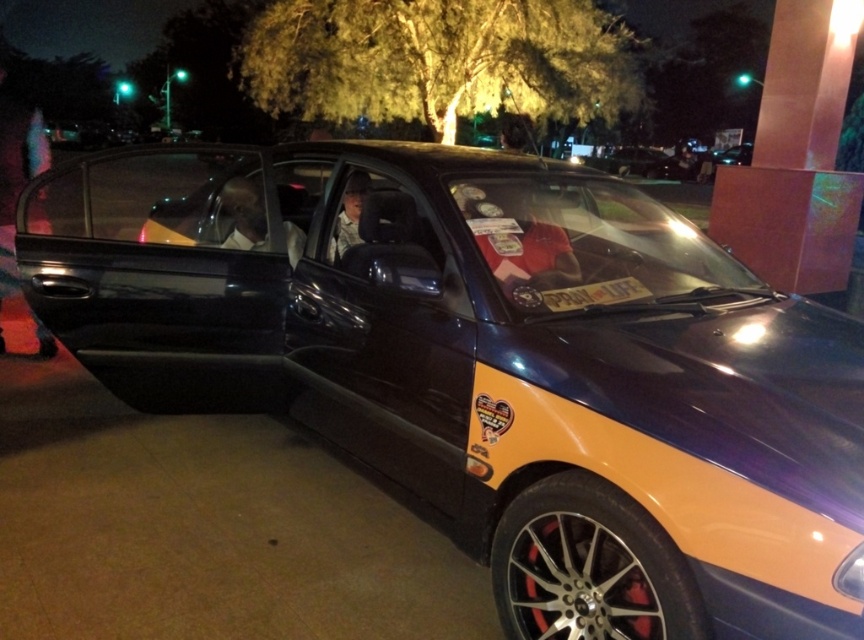
Question: In this image, where is matte red shirt at center located relative to matte black car door at left?

Choices:
 (A) above
 (B) below

Answer: (B)

Question: Which point is farther from the camera taking this photo?

Choices:
 (A) (621, 298)
 (B) (251, 195)

Answer: (B)

Question: Which point is closer to the camera?

Choices:
 (A) (42, 333)
 (B) (519, 228)

Answer: (B)

Question: Which of the following is the closest to the observer?

Choices:
 (A) matte black car door at left
 (B) metallic silver license plate at center

Answer: (B)

Question: From the image, what is the correct spatial relationship of matte black shirt at center in relation to metallic silver license plate at center?

Choices:
 (A) left
 (B) right

Answer: (A)

Question: Does matte red shirt at center appear under matte black car door at left?

Choices:
 (A) yes
 (B) no

Answer: (A)